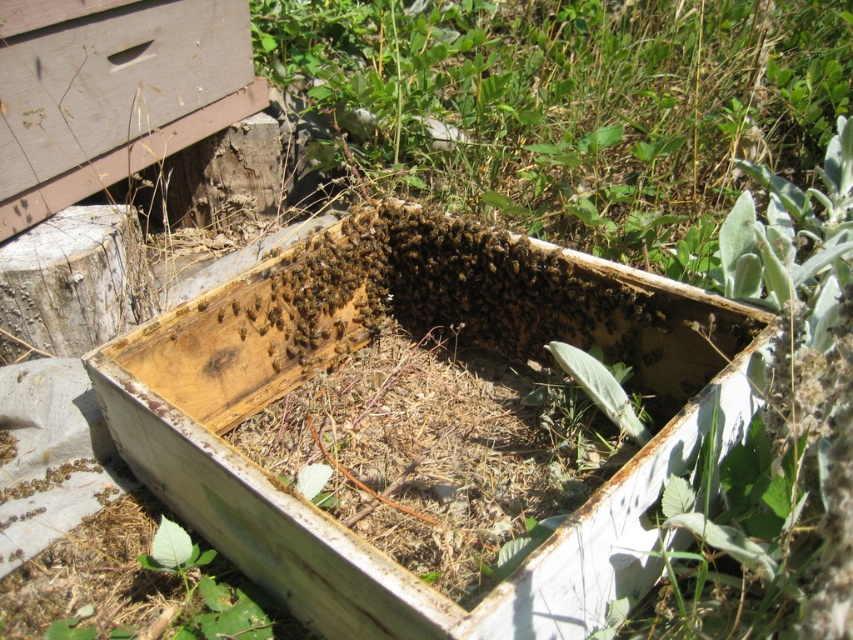
Question: Does weathered wood beehive at center appear under translucent yellowish honeycomb at center?

Choices:
 (A) yes
 (B) no

Answer: (A)

Question: Which point is farther from the camera taking this photo?

Choices:
 (A) (151, 406)
 (B) (218, 320)

Answer: (B)

Question: Does weathered wood beehive at center appear on the left side of translucent yellowish honeycomb at center?

Choices:
 (A) no
 (B) yes

Answer: (A)

Question: Is weathered wood beehive at center bigger than translucent yellowish honeycomb at center?

Choices:
 (A) yes
 (B) no

Answer: (A)